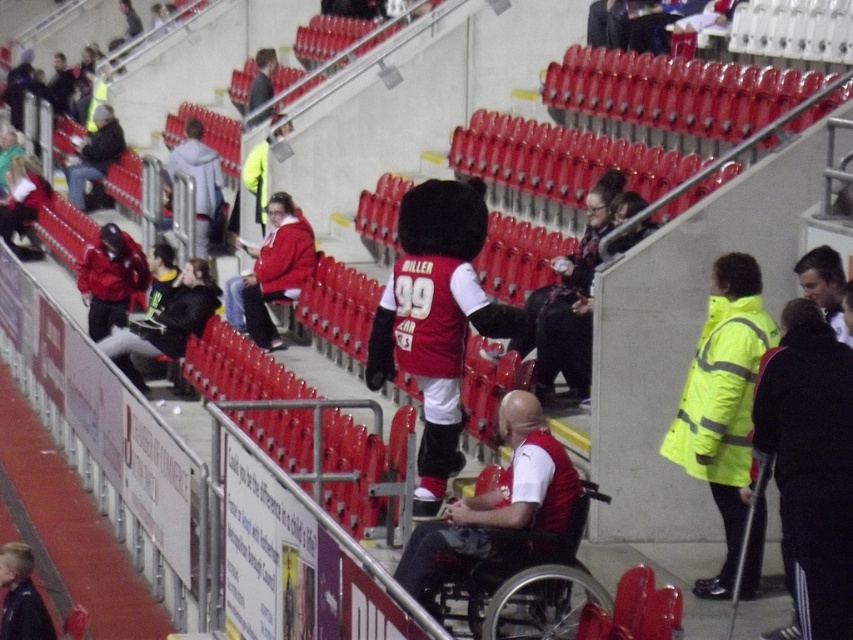
Is black plastic wheelchair at center thinner than matte black jacket at upper left?

Indeed, black plastic wheelchair at center has a lesser width compared to matte black jacket at upper left.

Is black plastic wheelchair at center wider than matte black jacket at upper left?

No.

Locate an element on the screen. Image resolution: width=853 pixels, height=640 pixels. black plastic wheelchair at center is located at coordinates (527, 586).

Based on the photo, can you confirm if red jersey at center is positioned to the left of black plastic wheelchair at center?

Indeed, red jersey at center is positioned on the left side of black plastic wheelchair at center.

Is red jersey at center wider than black plastic wheelchair at center?

Yes.

Image resolution: width=853 pixels, height=640 pixels. I want to click on red jersey at center, so click(x=498, y=512).

Is point (410, 241) positioned behind point (90, 177)?

No, it is in front of (90, 177).

Between red jersey plush mascot at center and matte black jacket at upper left, which one has less height?

Standing shorter between the two is matte black jacket at upper left.

Which is in front, point (424, 227) or point (109, 125)?

Positioned in front is point (424, 227).

Where is `red jersey plush mascot at center`? The height and width of the screenshot is (640, 853). red jersey plush mascot at center is located at coordinates (436, 317).